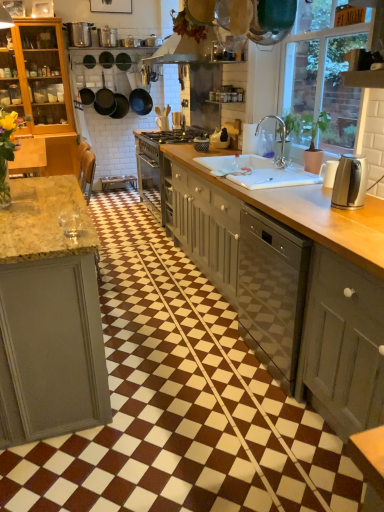
Describe the element at coordinates (178, 120) in the screenshot. The width and height of the screenshot is (384, 512). I see `satin silver toaster at center, marked as the second appliance in a left-to-right arrangement` at that location.

The height and width of the screenshot is (512, 384). What do you see at coordinates (104, 100) in the screenshot? I see `matte black frying pan at upper left, the third frying pan positioned from the right` at bounding box center [104, 100].

You are a GUI agent. You are given a task and a screenshot of the screen. Output one action in this format:
    pyautogui.click(x=<x>, y=<y>)
    Task: Click on the matte black kettle at upper center, the 3th appliance from the bottom
    
    Given the screenshot: What is the action you would take?
    pyautogui.click(x=220, y=139)

Which is correct: metallic silver pot at upper left, which appears as the fourth appliance when viewed from the front, is inside gold metallic faucet at upper right, or outside of it?

metallic silver pot at upper left, which appears as the fourth appliance when viewed from the front, is outside gold metallic faucet at upper right.

What are the coordinates of `appliance above the gold metallic faucet at upper right (from a real-world perspective)` in the screenshot? It's located at (79, 34).

Does gold metallic faucet at upper right lie behind white glossy sink at center?

Yes.

How many degrees apart are the facing directions of gold metallic faucet at upper right and white glossy sink at center?

They differ by 0.54 degrees in their facing directions.

Considering the positions of objects gold metallic faucet at upper right and white glossy sink at center in the image provided, who is more to the right, gold metallic faucet at upper right or white glossy sink at center?

gold metallic faucet at upper right is more to the right.

In the scene shown: From a real-world perspective, which is physically above, gold metallic faucet at upper right or white glossy sink at center?

gold metallic faucet at upper right, from a real-world perspective.

Which of these two, white glossy sink at center or silver metallic kettle at right, which ranks as the 5th appliance in left-to-right order, stands taller?

silver metallic kettle at right, which ranks as the 5th appliance in left-to-right order, is taller.

This screenshot has width=384, height=512. Find the location of `sink below the silver metallic kettle at right, the first appliance in the right-to-left sequence (from a real-world perspective)`. sink below the silver metallic kettle at right, the first appliance in the right-to-left sequence (from a real-world perspective) is located at coordinates (257, 172).

Would you say white glossy sink at center is outside silver metallic kettle at right, the first appliance in the right-to-left sequence?

That's correct, white glossy sink at center is outside of silver metallic kettle at right, the first appliance in the right-to-left sequence.

Is there a large distance between white glossy sink at center and silver metallic kettle at right, which ranks as the 5th appliance in left-to-right order?

white glossy sink at center is near silver metallic kettle at right, which ranks as the 5th appliance in left-to-right order, not far away.

Which is more to the right, matte black kettle at upper center, the third appliance from the back, or silver metallic kettle at right, which is counted as the fifth appliance, starting from the back?

silver metallic kettle at right, which is counted as the fifth appliance, starting from the back, is more to the right.

Find the location of a particular element. The image size is (384, 512). the 1st appliance counting from the left of the silver metallic kettle at right, the 1th appliance from the front is located at coordinates (220, 139).

Looking at this image, from the image's perspective, which is below, matte black kettle at upper center, the third appliance from the back, or silver metallic kettle at right, the fifth appliance when ordered from top to bottom?

silver metallic kettle at right, the fifth appliance when ordered from top to bottom, is shown below in the image.

Is matte black kettle at upper center, the third appliance from the back, shorter than silver metallic kettle at right, which is counted as the fifth appliance, starting from the back?

Incorrect, the height of matte black kettle at upper center, the third appliance from the back, does not fall short of that of silver metallic kettle at right, which is counted as the fifth appliance, starting from the back.

Which is closer to the camera, (363, 380) or (321, 239)?

Clearly, point (363, 380) is closer to the camera than point (321, 239).

Is the depth of matte gray cabinet at lower right less than that of wooden at center?

Yes, the depth of matte gray cabinet at lower right is less than that of wooden at center.

Considering the sizes of objects matte gray cabinet at lower right and wooden at center in the image provided, who is wider, matte gray cabinet at lower right or wooden at center?

Wider between the two is wooden at center.

Looking at this image, measure the distance from matte gray cabinet at lower right to wooden at center.

matte gray cabinet at lower right and wooden at center are 15.59 inches apart from each other.

In the scene shown: Between silver metallic kettle at right, the 1th appliance from the front, and matte gray cabinet at lower right, which one has more height?

matte gray cabinet at lower right.

Are silver metallic kettle at right, the first appliance in the right-to-left sequence, and matte gray cabinet at lower right located far from each other?

No, silver metallic kettle at right, the first appliance in the right-to-left sequence, is not far away from matte gray cabinet at lower right.

In the scene shown: Is silver metallic kettle at right, which is counted as the fifth appliance, starting from the back, oriented away from matte gray cabinet at lower right?

silver metallic kettle at right, which is counted as the fifth appliance, starting from the back, does not have its back to matte gray cabinet at lower right.

How many degrees apart are the facing directions of silver metallic kettle at right, the fifth appliance when ordered from top to bottom, and matte gray cabinet at lower right?

The facing directions of silver metallic kettle at right, the fifth appliance when ordered from top to bottom, and matte gray cabinet at lower right are 1.58 degrees apart.

Which object is positioned more to the right, satin silver kettle at right or black matte frying pan at upper center, which is the 3th frying pan in left-to-right order?

satin silver kettle at right.

Identify the location of kitchen appliance below the black matte frying pan at upper center, the 1th frying pan from the right (from a real-world perspective). The width and height of the screenshot is (384, 512). (350, 182).

Consider the image. From the image's perspective, would you say satin silver kettle at right is positioned over black matte frying pan at upper center, the 1th frying pan from the right?

No, from the image's perspective, satin silver kettle at right is not over black matte frying pan at upper center, the 1th frying pan from the right.

Which of these two, satin silver kettle at right or black matte frying pan at upper center, which is the 3th frying pan in left-to-right order, stands taller?

black matte frying pan at upper center, which is the 3th frying pan in left-to-right order, is taller.

Where is `tap below the metallic silver pot at upper left, which appears as the fourth appliance when viewed from the front (from the image's perspective)`? The height and width of the screenshot is (512, 384). tap below the metallic silver pot at upper left, which appears as the fourth appliance when viewed from the front (from the image's perspective) is located at coordinates (281, 139).

The height and width of the screenshot is (512, 384). I want to click on tap above the white glossy sink at center (from the image's perspective), so click(x=281, y=139).

When comparing their distances from matte gray cabinet at lower right, does black matte frying pan at upper center, which is the 3th frying pan in left-to-right order, or matte black frying pan at upper left, the 1th frying pan from the left, seem closer?

black matte frying pan at upper center, which is the 3th frying pan in left-to-right order, lies closer to matte gray cabinet at lower right than the other object.

Estimate the real-world distances between objects in this image. Which object is further from satin silver kettle at right, black matte frying pan at upper left, the second frying pan positioned from the left, or matte gray cabinet at lower right?

black matte frying pan at upper left, the second frying pan positioned from the left, is positioned further to the anchor satin silver kettle at right.

Considering their positions, is black matte frying pan at upper left, the second frying pan positioned from the left, positioned further to black matte frying pan at upper center, which is the 3th frying pan in left-to-right order, than satin silver toaster at center, the 4th appliance when ordered from right to left?

Based on the image, satin silver toaster at center, the 4th appliance when ordered from right to left, appears to be further to black matte frying pan at upper center, which is the 3th frying pan in left-to-right order.

When comparing their distances from matte gray cabinet at lower right, does wooden at center or metallic silver pot at upper left, placed as the fifth appliance when sorted from bottom to top, seem closer?

The object closer to matte gray cabinet at lower right is wooden at center.

From the picture: Looking at the image, which one is located closer to black matte frying pan at upper left, the second frying pan positioned from the left, black matte frying pan at upper center, which is the 3th frying pan in left-to-right order, or matte black kettle at upper center, which ranks as the 3th appliance in top-to-bottom order?

black matte frying pan at upper center, which is the 3th frying pan in left-to-right order, is closer to black matte frying pan at upper left, the second frying pan positioned from the left.

Considering their positions, is white glossy sink at center positioned closer to metallic silver pot at upper left, placed as the fifth appliance when sorted from bottom to top, than satin silver kettle at right?

white glossy sink at center is closer to metallic silver pot at upper left, placed as the fifth appliance when sorted from bottom to top.

Which object lies further to the anchor point white glossy sink at center, satin silver kettle at right or matte black frying pan at upper left, the 1th frying pan from the left?

matte black frying pan at upper left, the 1th frying pan from the left, is further to white glossy sink at center.

Based on their spatial positions, is white glossy sink at center or wooden at center further from satin silver kettle at right?

Based on the image, white glossy sink at center appears to be further to satin silver kettle at right.

What are the coordinates of `tap between white glossy sink at center and silver metallic kettle at right, arranged as the first appliance when ordered from the bottom` in the screenshot? It's located at (281, 139).

Where is `sink positioned between silver metallic kettle at right, the first appliance in the right-to-left sequence, and matte black kettle at upper center, the third appliance from the back, from near to far`? sink positioned between silver metallic kettle at right, the first appliance in the right-to-left sequence, and matte black kettle at upper center, the third appliance from the back, from near to far is located at coordinates (257, 172).

At what (x,y) coordinates should I click in order to perform the action: click on sink between wooden at center and matte black basket at center, which is the 2th appliance in front-to-back order, from front to back. Please return your answer as a coordinate pair (x, y). Image resolution: width=384 pixels, height=512 pixels. Looking at the image, I should click on (257, 172).

Identify the location of sink positioned between satin silver kettle at right and matte black frying pan at upper left, the 1th frying pan from the left, from near to far. (257, 172).